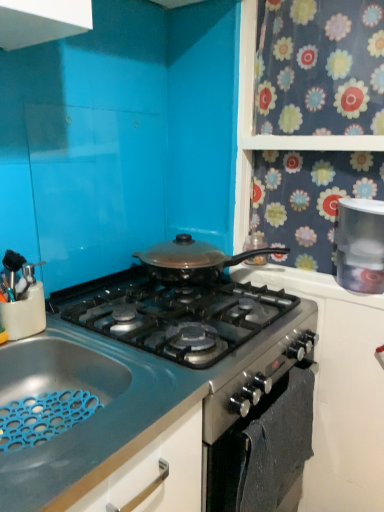
Question: Can you confirm if white plastic container at upper right is wider than satin silver oven at lower center?

Choices:
 (A) yes
 (B) no

Answer: (A)

Question: Is white plastic container at upper right taller than satin silver oven at lower center?

Choices:
 (A) no
 (B) yes

Answer: (A)

Question: Is white plastic container at upper right at the right side of satin silver oven at lower center?

Choices:
 (A) no
 (B) yes

Answer: (B)

Question: Is white plastic container at upper right turned away from satin silver oven at lower center?

Choices:
 (A) yes
 (B) no

Answer: (B)

Question: Is satin silver oven at lower center completely or partially inside white plastic container at upper right?

Choices:
 (A) yes
 (B) no

Answer: (B)

Question: From the image's perspective, is blue rubber mat at lower left positioned above or below white plastic container at upper right?

Choices:
 (A) above
 (B) below

Answer: (B)

Question: Considering the positions of blue rubber mat at lower left and white plastic container at upper right in the image, is blue rubber mat at lower left taller or shorter than white plastic container at upper right?

Choices:
 (A) short
 (B) tall

Answer: (A)

Question: Is blue rubber mat at lower left in front of or behind white plastic container at upper right in the image?

Choices:
 (A) behind
 (B) front

Answer: (B)

Question: From a real-world perspective, is blue rubber mat at lower left above or below white plastic container at upper right?

Choices:
 (A) above
 (B) below

Answer: (B)

Question: Relative to satin black pan at center, is white plastic container at upper right in front or behind?

Choices:
 (A) front
 (B) behind

Answer: (B)

Question: From a real-world perspective, relative to satin black pan at center, is white plastic container at upper right vertically above or below?

Choices:
 (A) above
 (B) below

Answer: (A)

Question: Visually, is white plastic container at upper right positioned to the left or to the right of satin black pan at center?

Choices:
 (A) right
 (B) left

Answer: (A)

Question: Considering the positions of white plastic container at upper right and satin black pan at center in the image, is white plastic container at upper right wider or thinner than satin black pan at center?

Choices:
 (A) thin
 (B) wide

Answer: (A)

Question: Visually, is satin silver oven at lower center positioned to the left or to the right of satin black pan at center?

Choices:
 (A) right
 (B) left

Answer: (A)

Question: In terms of size, does satin silver oven at lower center appear bigger or smaller than satin black pan at center?

Choices:
 (A) small
 (B) big

Answer: (A)